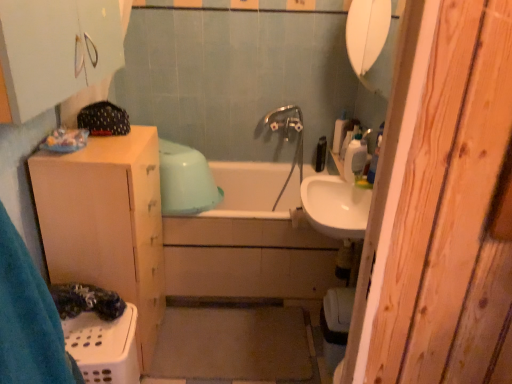
Identify the location of empty space that is ontop of white plastic laundry basket at lower left (from a real-world perspective). Image resolution: width=512 pixels, height=384 pixels. (92, 325).